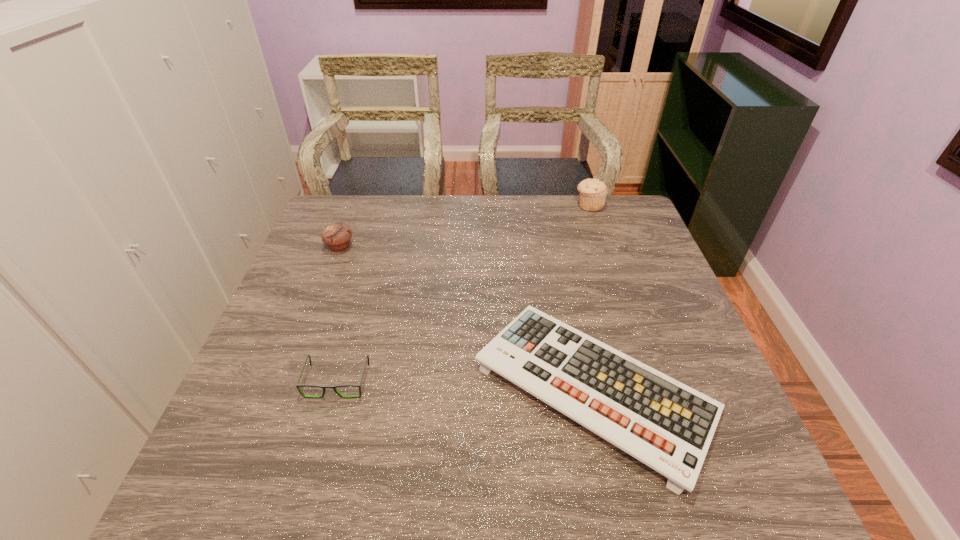
Image resolution: width=960 pixels, height=540 pixels. I want to click on free spot between the third nearest object and the spectacles, so click(x=339, y=314).

Identify the location of free spot between the farthest object and the spectacles. The width and height of the screenshot is (960, 540). (464, 293).

I want to click on vacant space that is in between the spectacles and the taller muffin, so tap(464, 293).

Where is `free point between the computer keyboard and the spectacles`? The width and height of the screenshot is (960, 540). free point between the computer keyboard and the spectacles is located at coordinates (466, 384).

Locate an element on the screen. This screenshot has width=960, height=540. object that is the third closest to the computer keyboard is located at coordinates (593, 192).

Locate an element on the screen. This screenshot has width=960, height=540. the third closest object relative to the spectacles is located at coordinates (593, 192).